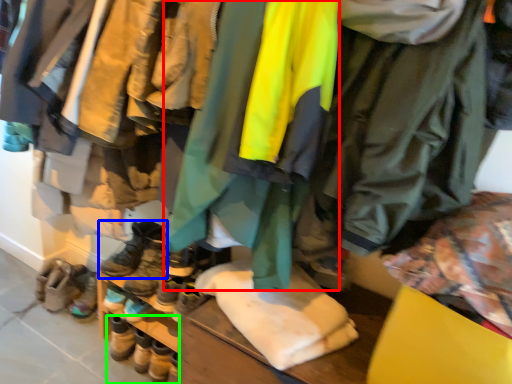
Question: Which object is the closest to the jacket (highlighted by a red box)? Choose among these: footwear (highlighted by a blue box) or footwear (highlighted by a green box).

Choices:
 (A) footwear
 (B) footwear

Answer: (A)